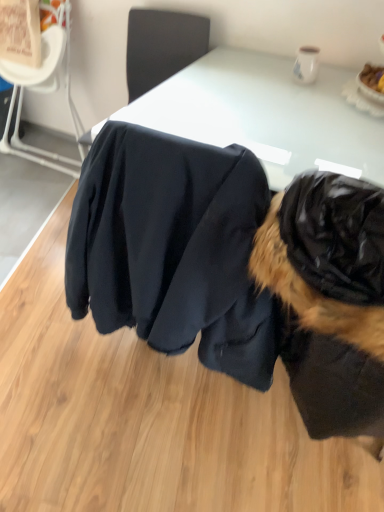
Question: Is white glossy table at center positioned behind black fabric chair at upper center, which is counted as the second chair, starting from the left?

Choices:
 (A) yes
 (B) no

Answer: (B)

Question: From the image's perspective, is white glossy table at center beneath black fabric chair at upper center, which is counted as the second chair, starting from the left?

Choices:
 (A) yes
 (B) no

Answer: (A)

Question: Does white glossy table at center appear on the left side of black fabric chair at upper center, marked as the 1th chair in a right-to-left arrangement?

Choices:
 (A) yes
 (B) no

Answer: (B)

Question: From a real-world perspective, is white glossy table at center on top of black fabric chair at upper center, marked as the 1th chair in a right-to-left arrangement?

Choices:
 (A) no
 (B) yes

Answer: (A)

Question: Considering the relative sizes of white glossy table at center and black fabric chair at upper center, which is counted as the second chair, starting from the left, in the image provided, is white glossy table at center smaller than black fabric chair at upper center, which is counted as the second chair, starting from the left,?

Choices:
 (A) yes
 (B) no

Answer: (B)

Question: Do you think white glossy table at center is within matte black jacket at center, or outside of it?

Choices:
 (A) outside
 (B) inside

Answer: (A)

Question: From a real-world perspective, is white glossy table at center positioned above or below matte black jacket at center?

Choices:
 (A) above
 (B) below

Answer: (A)

Question: In terms of size, does white glossy table at center appear bigger or smaller than matte black jacket at center?

Choices:
 (A) small
 (B) big

Answer: (B)

Question: Is point (163, 98) positioned closer to the camera than point (261, 316)?

Choices:
 (A) farther
 (B) closer

Answer: (A)

Question: Is white glossy table at center bigger or smaller than black fur coat at right?

Choices:
 (A) big
 (B) small

Answer: (A)

Question: From the image's perspective, relative to black fur coat at right, is white glossy table at center above or below?

Choices:
 (A) below
 (B) above

Answer: (B)

Question: In the image, is white glossy table at center positioned in front of or behind black fur coat at right?

Choices:
 (A) behind
 (B) front

Answer: (A)

Question: Considering the positions of white glossy table at center and black fur coat at right in the image, is white glossy table at center wider or thinner than black fur coat at right?

Choices:
 (A) thin
 (B) wide

Answer: (B)

Question: In terms of width, does black fur coat at right look wider or thinner when compared to matte black jacket at center?

Choices:
 (A) thin
 (B) wide

Answer: (A)

Question: Is black fur coat at right inside or outside of matte black jacket at center?

Choices:
 (A) inside
 (B) outside

Answer: (B)